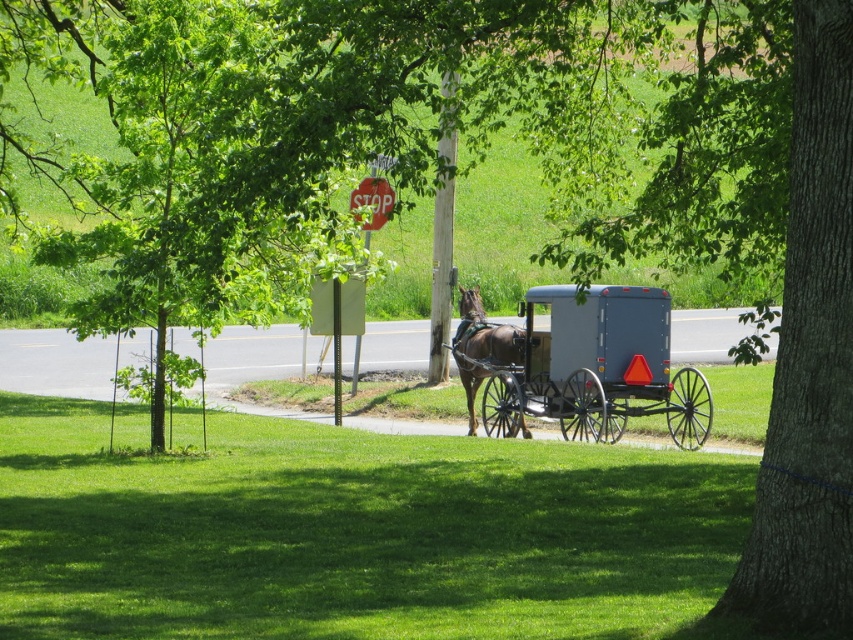
Is matte gray wagon at center in front of brown glossy horse at center?

Yes, matte gray wagon at center is in front of brown glossy horse at center.

Does matte gray wagon at center appear under brown glossy horse at center?

Indeed, matte gray wagon at center is positioned under brown glossy horse at center.

This screenshot has width=853, height=640. I want to click on matte gray wagon at center, so click(579, 365).

The width and height of the screenshot is (853, 640). In order to click on matte gray wagon at center in this screenshot , I will do `click(579, 365)`.